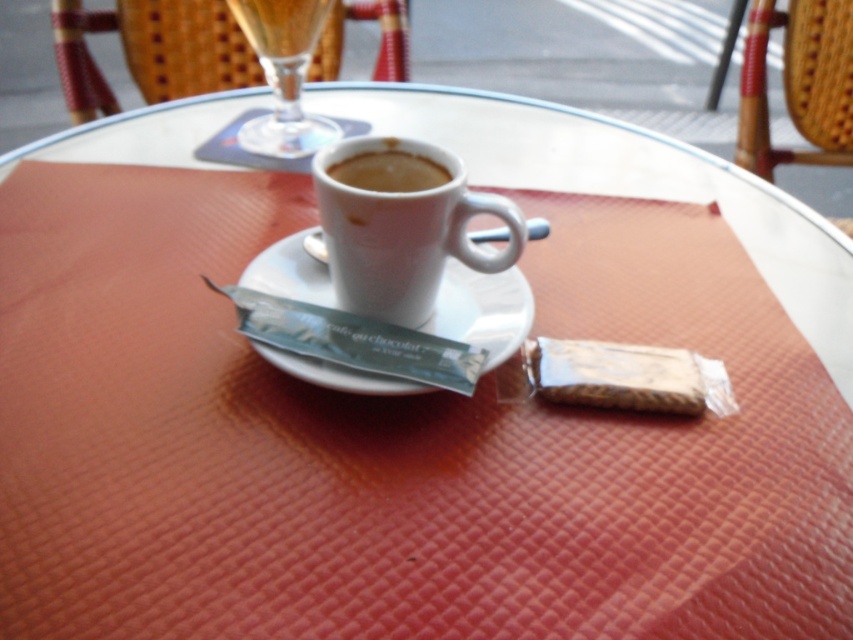
Which is below, woven wicker chair at upper right or clear glass at upper center?

Positioned lower is clear glass at upper center.

What do you see at coordinates (798, 83) in the screenshot? I see `woven wicker chair at upper right` at bounding box center [798, 83].

Is point (787, 54) in front of point (306, 42)?

No, (787, 54) is further to viewer.

Identify the location of woven wicker chair at upper right. (798, 83).

Describe the element at coordinates (402, 228) in the screenshot. I see `white ceramic mug at center` at that location.

Identify the location of white ceramic mug at center. (402, 228).

Is point (440, 204) positioned behind point (277, 138)?

No, (440, 204) is closer to viewer.

What are the coordinates of `white ceramic mug at center` in the screenshot? It's located at (402, 228).

Who is more distant from viewer, (432, 305) or (302, 134)?

Positioned behind is point (302, 134).

Find the location of a particular element. white ceramic mug at center is located at coordinates (402, 228).